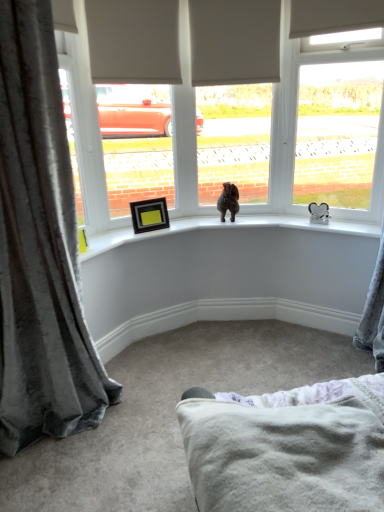
What do you see at coordinates (228, 201) in the screenshot? The height and width of the screenshot is (512, 384). I see `brown plush bear at center` at bounding box center [228, 201].

This screenshot has height=512, width=384. Describe the element at coordinates (40, 248) in the screenshot. I see `velvet gray curtain at left` at that location.

You are a GUI agent. You are given a task and a screenshot of the screen. Output one action in this format:
    pyautogui.click(x=<x>, y=<y>)
    Task: Click on the black matte picture frame at upper left
    This screenshot has width=384, height=512.
    Given the screenshot: What is the action you would take?
    pyautogui.click(x=149, y=215)

What is the approximate width of black matte picture frame at upper left?

It is 4.43 inches.

The height and width of the screenshot is (512, 384). What do you see at coordinates (288, 448) in the screenshot? I see `soft white fleece blanket at lower center` at bounding box center [288, 448].

At what (x,y) coordinates should I click in order to perform the action: click on brown plush bear at center. Please return your answer as a coordinate pair (x, y). This screenshot has width=384, height=512. Looking at the image, I should click on (228, 201).

Does point (159, 211) appear closer or farther from the camera than point (234, 214)?

Point (159, 211) is positioned closer to the camera compared to point (234, 214).

From the image's perspective, which one is positioned higher, black matte picture frame at upper left or brown plush bear at center?

brown plush bear at center is shown above in the image.

Is black matte picture frame at upper left facing towards brown plush bear at center?

No.

Is black matte picture frame at upper left not inside brown plush bear at center?

That's correct, black matte picture frame at upper left is outside of brown plush bear at center.

Would you say soft white fleece blanket at lower center contains velvet gray curtain at left?

No, soft white fleece blanket at lower center does not contain velvet gray curtain at left.

Relative to velvet gray curtain at left, is soft white fleece blanket at lower center in front or behind?

soft white fleece blanket at lower center is in front of velvet gray curtain at left.

Consider the image. From the image's perspective, would you say soft white fleece blanket at lower center is shown under velvet gray curtain at left?

Yes, from the image's perspective, soft white fleece blanket at lower center is beneath velvet gray curtain at left.

What's the angular difference between soft white fleece blanket at lower center and velvet gray curtain at left's facing directions?

92.7 degrees.

Looking at the image, does white plastic window at upper right seem bigger or smaller compared to velvet gray curtain at left?

Clearly, white plastic window at upper right is smaller in size than velvet gray curtain at left.

Consider the image. From a real-world perspective, is white plastic window at upper right physically below velvet gray curtain at left?

No, from a real-world perspective, white plastic window at upper right is not below velvet gray curtain at left.

In the scene shown: From the image's perspective, is white plastic window at upper right beneath velvet gray curtain at left?

No.

Measure the distance from white plastic window at upper right to velvet gray curtain at left.

A distance of 1.71 meters exists between white plastic window at upper right and velvet gray curtain at left.

Considering the relative positions of brown plush bear at center and velvet gray curtain at left in the image provided, is brown plush bear at center to the right of velvet gray curtain at left from the viewer's perspective?

Yes.

From the image's perspective, which is below, brown plush bear at center or velvet gray curtain at left?

velvet gray curtain at left.

Locate an element on the screen. animal lying on the right of velvet gray curtain at left is located at coordinates [228, 201].

Is brown plush bear at center turned away from velvet gray curtain at left?

No.

Which is less distant, (370, 131) or (370, 453)?

The point (370, 453) is closer to the camera.

From the picture: Would you consider white plastic window at upper right to be distant from soft white fleece blanket at lower center?

white plastic window at upper right is far away from soft white fleece blanket at lower center.

Is white plastic window at upper right positioned with its back to soft white fleece blanket at lower center?

No, white plastic window at upper right's orientation is not away from soft white fleece blanket at lower center.

Considering the positions of objects white plastic window at upper right and soft white fleece blanket at lower center in the image provided, who is more to the right, white plastic window at upper right or soft white fleece blanket at lower center?

From the viewer's perspective, white plastic window at upper right appears more on the right side.

Between soft white fleece blanket at lower center and white plastic window at upper right, which one has smaller width?

white plastic window at upper right.

Locate an element on the screen. The height and width of the screenshot is (512, 384). window to the right of soft white fleece blanket at lower center is located at coordinates (338, 133).

Can you confirm if soft white fleece blanket at lower center is positioned to the left of white plastic window at upper right?

Yes.

Between soft white fleece blanket at lower center and white plastic window at upper right, which one has smaller size?

soft white fleece blanket at lower center.

Do you think white plastic window at upper right is within black matte picture frame at upper left, or outside of it?

The correct answer is: outside.

The height and width of the screenshot is (512, 384). What are the coordinates of `picture frame that is below the white plastic window at upper right (from the image's perspective)` in the screenshot? It's located at (149, 215).

Which is less distant, (331, 140) or (165, 223)?

The point (331, 140) is in front.

Who is smaller, white plastic window at upper right or black matte picture frame at upper left?

black matte picture frame at upper left.

Where is `animal lying on the right of black matte picture frame at upper left`? animal lying on the right of black matte picture frame at upper left is located at coordinates (228, 201).

This screenshot has width=384, height=512. I want to click on curtain that appears above the soft white fleece blanket at lower center (from the image's perspective), so click(x=40, y=248).

Looking at the image, which one is located closer to white plastic window at upper right, velvet gray curtain at left or soft white fleece blanket at lower center?

The object closer to white plastic window at upper right is velvet gray curtain at left.

Which object lies further to the anchor point soft white fleece blanket at lower center, black matte picture frame at upper left or velvet gray curtain at left?

black matte picture frame at upper left is positioned further to the anchor soft white fleece blanket at lower center.

Which object lies nearer to the anchor point brown plush bear at center, soft white fleece blanket at lower center or velvet gray curtain at left?

The object closer to brown plush bear at center is velvet gray curtain at left.

Estimate the real-world distances between objects in this image. Which object is closer to black matte picture frame at upper left, white plastic window at upper right or velvet gray curtain at left?

velvet gray curtain at left is positioned closer to the anchor black matte picture frame at upper left.

From the image, which object appears to be farther from white plastic window at upper right, soft white fleece blanket at lower center or brown plush bear at center?

Based on the image, soft white fleece blanket at lower center appears to be further to white plastic window at upper right.

Looking at the image, which one is located closer to soft white fleece blanket at lower center, white plastic window at upper right or velvet gray curtain at left?

Based on the image, velvet gray curtain at left appears to be nearer to soft white fleece blanket at lower center.

Based on the photo, estimate the real-world distances between objects in this image. Which object is further from brown plush bear at center, white plastic window at upper right or velvet gray curtain at left?

The object further to brown plush bear at center is velvet gray curtain at left.

Considering their positions, is white plastic window at upper right positioned further to black matte picture frame at upper left than brown plush bear at center?

white plastic window at upper right is further to black matte picture frame at upper left.

Locate an element on the screen. window between soft white fleece blanket at lower center and black matte picture frame at upper left in the front-back direction is located at coordinates (338, 133).

This screenshot has height=512, width=384. What are the coordinates of `bedding between velvet gray curtain at left and white plastic window at upper right from left to right` in the screenshot? It's located at (288, 448).

Identify the location of picture frame positioned between velvet gray curtain at left and brown plush bear at center from near to far. (149, 215).

You are a GUI agent. You are given a task and a screenshot of the screen. Output one action in this format:
    pyautogui.click(x=<x>, y=<y>)
    Task: Click on the animal between velvet gray curtain at left and white plastic window at upper right from left to right
    Image resolution: width=384 pixels, height=512 pixels.
    Given the screenshot: What is the action you would take?
    pyautogui.click(x=228, y=201)